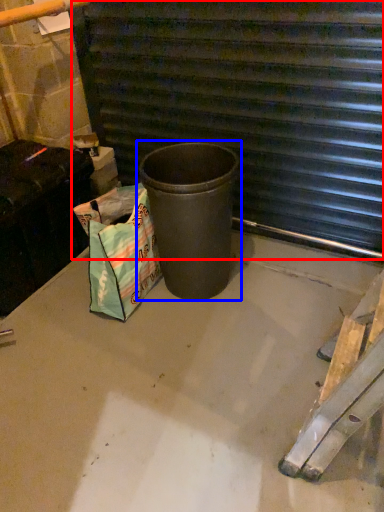
Question: Which point is closer to the camera, stairwell (highlighted by a red box) or waste container (highlighted by a blue box)?

Choices:
 (A) stairwell
 (B) waste container

Answer: (A)